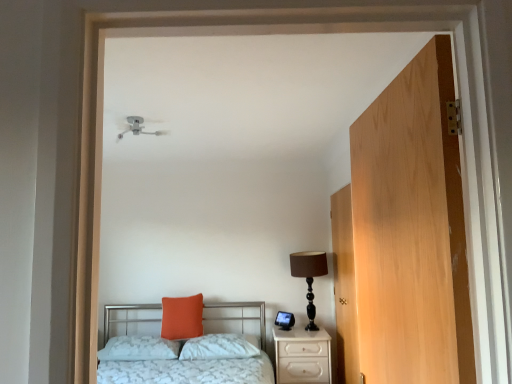
Question: Could you tell me if orange matte pillow at center, the first pillow when ordered from left to right, is turned towards light brown wood door at right, placed as the 1th door when sorted from right to left?

Choices:
 (A) no
 (B) yes

Answer: (A)

Question: From a real-world perspective, is orange matte pillow at center, the first pillow when ordered from left to right, positioned under light brown wood door at right, placed as the 1th door when sorted from right to left, based on gravity?

Choices:
 (A) no
 (B) yes

Answer: (B)

Question: Is orange matte pillow at center, the 3th pillow viewed from the right, far away from light brown wood door at right, the 2th door viewed from the left?

Choices:
 (A) yes
 (B) no

Answer: (A)

Question: Does orange matte pillow at center, the 3th pillow viewed from the right, have a greater height compared to light brown wood door at right, positioned as the 2th door in front-to-back order?

Choices:
 (A) no
 (B) yes

Answer: (A)

Question: Is orange matte pillow at center, the 3th pillow viewed from the right, further to camera compared to light brown wood door at right, the 2th door viewed from the left?

Choices:
 (A) no
 (B) yes

Answer: (B)

Question: From their relative heights in the image, would you say orange fabric pillow at center, which is the second pillow in right-to-left order, is taller or shorter than brown fabric lampshade at right?

Choices:
 (A) tall
 (B) short

Answer: (B)

Question: In terms of width, does orange fabric pillow at center, which is the second pillow in right-to-left order, look wider or thinner when compared to brown fabric lampshade at right?

Choices:
 (A) wide
 (B) thin

Answer: (B)

Question: Considering their positions, is orange fabric pillow at center, which is the second pillow in right-to-left order, located in front of or behind brown fabric lampshade at right?

Choices:
 (A) front
 (B) behind

Answer: (B)

Question: Does point (201, 334) appear closer or farther from the camera than point (291, 274)?

Choices:
 (A) farther
 (B) closer

Answer: (B)

Question: Based on their positions, is light brown wood door at right, placed as the 1th door when sorted from right to left, located to the left or right of white glossy nightstand at lower right?

Choices:
 (A) left
 (B) right

Answer: (B)

Question: Would you say light brown wood door at right, placed as the 1th door when sorted from right to left, is inside or outside white glossy nightstand at lower right?

Choices:
 (A) inside
 (B) outside

Answer: (B)

Question: From the image's perspective, is light brown wood door at right, the 2th door viewed from the left, above or below white glossy nightstand at lower right?

Choices:
 (A) above
 (B) below

Answer: (A)

Question: Does point 347,294 appear closer or farther from the camera than point 311,364?

Choices:
 (A) closer
 (B) farther

Answer: (A)

Question: Considering the positions of point (325, 329) and point (400, 223), is point (325, 329) closer or farther from the camera than point (400, 223)?

Choices:
 (A) farther
 (B) closer

Answer: (A)

Question: In the image, is white glossy nightstand at lower right positioned in front of or behind light wood door at right, which appears as the second door when viewed from the back?

Choices:
 (A) front
 (B) behind

Answer: (B)